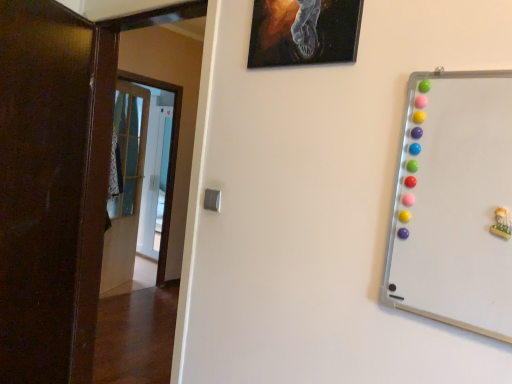
Question: Is transparent glass door at center completely or partially outside of dark wood door at left, the third door positioned from the back?

Choices:
 (A) yes
 (B) no

Answer: (A)

Question: Is dark wood door at left, which is counted as the first door, starting from the front, at the back of transparent glass door at center?

Choices:
 (A) yes
 (B) no

Answer: (B)

Question: Would you say transparent glass door at center contains dark wood door at left, the third door positioned from the back?

Choices:
 (A) no
 (B) yes

Answer: (A)

Question: From the image's perspective, is transparent glass door at center beneath dark wood door at left, the third door positioned from the back?

Choices:
 (A) yes
 (B) no

Answer: (B)

Question: Considering the relative positions of transparent glass door at center and dark wood door at left, which is counted as the first door, starting from the front, in the image provided, is transparent glass door at center in front of dark wood door at left, which is counted as the first door, starting from the front,?

Choices:
 (A) no
 (B) yes

Answer: (A)

Question: From the image's perspective, relative to dark wood door at left, which is counted as the first door, starting from the front, is transparent glass door at center above or below?

Choices:
 (A) below
 (B) above

Answer: (B)

Question: In terms of width, does transparent glass door at center look wider or thinner when compared to dark wood door at left, which is counted as the first door, starting from the front?

Choices:
 (A) wide
 (B) thin

Answer: (A)

Question: From a real-world perspective, is transparent glass door at center positioned above or below dark wood door at left, which is counted as the first door, starting from the front?

Choices:
 (A) above
 (B) below

Answer: (B)

Question: Which is correct: transparent glass door at center is inside dark wood door at left, which is counted as the first door, starting from the front, or outside of it?

Choices:
 (A) outside
 (B) inside

Answer: (A)

Question: Which is correct: dark wood door at left, which is counted as the first door, starting from the front, is inside transparent glass door at center, or outside of it?

Choices:
 (A) inside
 (B) outside

Answer: (B)

Question: Is point click(10, 43) positioned closer to the camera than point click(159, 145)?

Choices:
 (A) farther
 (B) closer

Answer: (B)

Question: Visually, is dark wood door at left, the third door positioned from the back, positioned to the left or to the right of transparent glass door at center?

Choices:
 (A) left
 (B) right

Answer: (B)

Question: Considering their positions, is dark wood door at left, which is counted as the first door, starting from the front, located in front of or behind transparent glass door at center?

Choices:
 (A) front
 (B) behind

Answer: (A)

Question: Is black canvas painting at upper center inside or outside of whiteboard at right?

Choices:
 (A) outside
 (B) inside

Answer: (A)

Question: Considering the positions of black canvas painting at upper center and whiteboard at right in the image, is black canvas painting at upper center wider or thinner than whiteboard at right?

Choices:
 (A) wide
 (B) thin

Answer: (A)